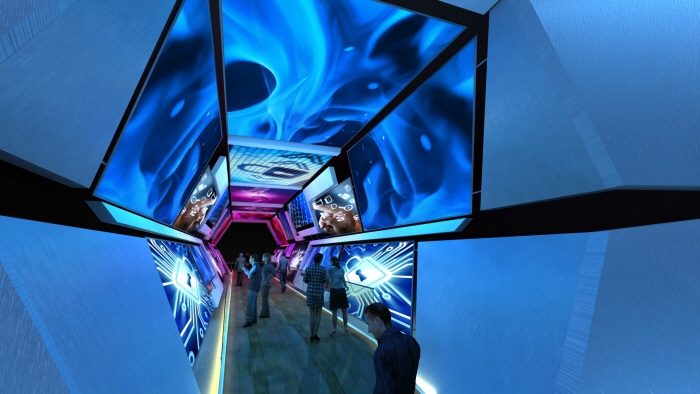
Find the location of a particular element. floor is located at coordinates (295, 357).